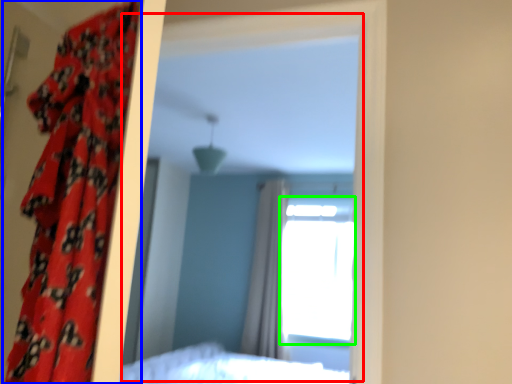
Question: Considering the real-world distances, which object is farthest from mirror (highlighted by a red box)? curtain (highlighted by a blue box) or window (highlighted by a green box)?

Choices:
 (A) curtain
 (B) window

Answer: (A)